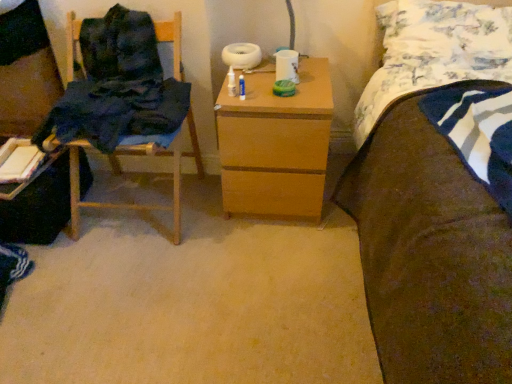
Question: Considering the positions of wooden nightstand at center and brown fabric bed at right in the image, is wooden nightstand at center taller or shorter than brown fabric bed at right?

Choices:
 (A) short
 (B) tall

Answer: (A)

Question: Does point (285, 162) appear closer or farther from the camera than point (374, 135)?

Choices:
 (A) farther
 (B) closer

Answer: (A)

Question: Estimate the real-world distances between objects in this image. Which object is closer to the dark blue fabric chair at left?

Choices:
 (A) white cardboard book at left
 (B) floral fabric pillow at upper right
 (C) dark blue fabric at left
 (D) brown fabric bed at right
 (E) wooden chair at left

Answer: (A)

Question: Which object is positioned farthest from the floral fabric pillow at upper right?

Choices:
 (A) wooden nightstand at center
 (B) dark blue fabric chair at left
 (C) dark blue fabric at left
 (D) brown fabric bed at right
 (E) white cardboard book at left

Answer: (E)